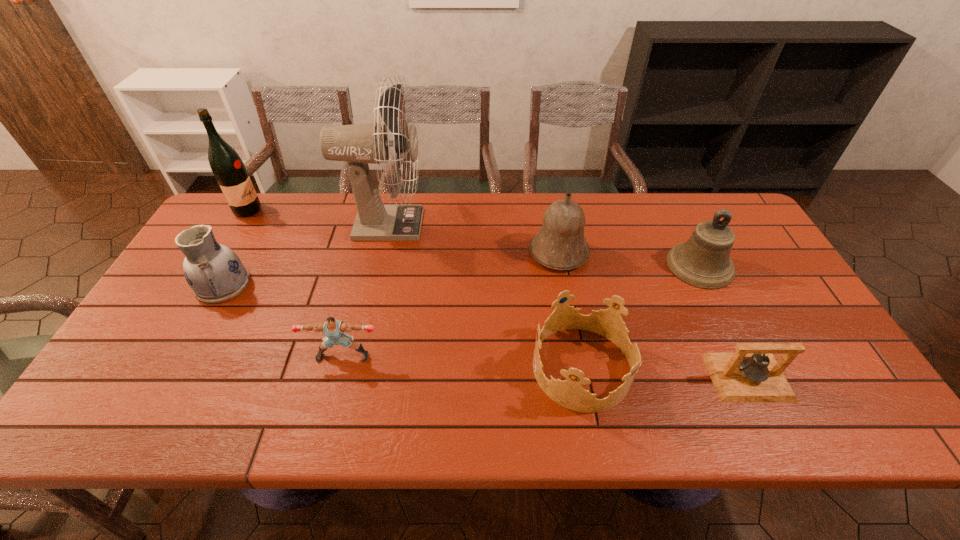
Locate an element on the screen. bell that is the second closest one to the leftmost bell is located at coordinates (751, 374).

Select which bell is the second closest to the tiara. Please provide its 2D coordinates. Your answer should be formatted as a tuple, i.e. [(x, y)], where the tuple contains the x and y coordinates of a point satisfying the conditions above.

[(560, 244)]

At what (x,y) coordinates should I click in order to perform the action: click on free region that satisfies the following two spatial constraints: 1. on the front-facing side of the shortest object; 2. on the left side of the tiara. Please return your answer as a coordinate pair (x, y). Looking at the image, I should click on (585, 377).

At what (x,y) coordinates should I click in order to perform the action: click on free space that satisfies the following two spatial constraints: 1. on the front-facing side of the liquor; 2. on the left side of the shortest object. Please return your answer as a coordinate pair (x, y). The height and width of the screenshot is (540, 960). Looking at the image, I should click on (148, 377).

Locate an element on the screen. This screenshot has width=960, height=540. blank area in the image that satisfies the following two spatial constraints: 1. on the front side of the pottery; 2. on the right side of the nearest bell is located at coordinates (172, 377).

Find the location of a particular element. free space that satisfies the following two spatial constraints: 1. on the front-facing side of the liquor; 2. on the back side of the leftmost bell is located at coordinates (223, 253).

The image size is (960, 540). I want to click on free space that satisfies the following two spatial constraints: 1. on the back side of the shortest bell; 2. on the front-facing side of the liquor, so click(667, 210).